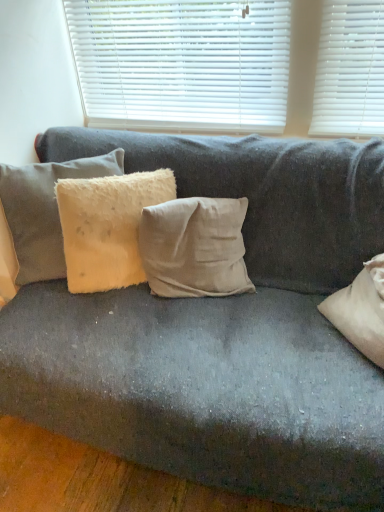
Question: Considering the relative sizes of fuzzy beige pillow at left, the third pillow when ordered from right to left, and fuzzy beige pillow at center, arranged as the 2th pillow when viewed from the left, in the image provided, is fuzzy beige pillow at left, the third pillow when ordered from right to left, shorter than fuzzy beige pillow at center, arranged as the 2th pillow when viewed from the left,?

Choices:
 (A) no
 (B) yes

Answer: (A)

Question: Considering the relative positions of fuzzy beige pillow at left, the third pillow when ordered from right to left, and fuzzy beige pillow at center, arranged as the 2th pillow when viewed from the left, in the image provided, is fuzzy beige pillow at left, the third pillow when ordered from right to left, to the left of fuzzy beige pillow at center, arranged as the 2th pillow when viewed from the left, from the viewer's perspective?

Choices:
 (A) no
 (B) yes

Answer: (B)

Question: Considering the relative sizes of fuzzy beige pillow at left, which appears as the 1th pillow when viewed from the left, and fuzzy beige pillow at center, the 2th pillow from the right, in the image provided, is fuzzy beige pillow at left, which appears as the 1th pillow when viewed from the left, smaller than fuzzy beige pillow at center, the 2th pillow from the right,?

Choices:
 (A) yes
 (B) no

Answer: (B)

Question: Does fuzzy beige pillow at left, the third pillow when ordered from right to left, come in front of fuzzy beige pillow at center, the 2th pillow from the right?

Choices:
 (A) no
 (B) yes

Answer: (A)

Question: Is fuzzy beige pillow at left, which appears as the 1th pillow when viewed from the left, positioned beyond the bounds of fuzzy beige pillow at center, the 2th pillow from the right?

Choices:
 (A) yes
 (B) no

Answer: (A)

Question: Considering their positions, is fuzzy beige pillow at center, arranged as the 2th pillow when viewed from the left, located in front of or behind white plastic blinds at upper center?

Choices:
 (A) front
 (B) behind

Answer: (A)

Question: Looking at their shapes, would you say fuzzy beige pillow at center, arranged as the 2th pillow when viewed from the left, is wider or thinner than white plastic blinds at upper center?

Choices:
 (A) wide
 (B) thin

Answer: (A)

Question: Is point (107, 177) closer or farther from the camera than point (155, 117)?

Choices:
 (A) farther
 (B) closer

Answer: (B)

Question: Is fuzzy beige pillow at center, the 2th pillow from the right, to the left or to the right of white plastic blinds at upper center in the image?

Choices:
 (A) left
 (B) right

Answer: (A)

Question: From the image's perspective, is beige cotton cushion at center, which is counted as the first pillow, starting from the right, positioned above or below white plastic blinds at upper center?

Choices:
 (A) above
 (B) below

Answer: (B)

Question: Is beige cotton cushion at center, which is counted as the first pillow, starting from the right, spatially inside white plastic blinds at upper center, or outside of it?

Choices:
 (A) inside
 (B) outside

Answer: (B)

Question: Looking at the image, does beige cotton cushion at center, which is counted as the first pillow, starting from the right, seem bigger or smaller compared to white plastic blinds at upper center?

Choices:
 (A) big
 (B) small

Answer: (A)

Question: From a real-world perspective, is beige cotton cushion at center, placed as the 3th pillow when sorted from left to right, physically located above or below white plastic blinds at upper center?

Choices:
 (A) below
 (B) above

Answer: (A)

Question: In the image, is fuzzy beige pillow at left, the third pillow when ordered from right to left, positioned in front of or behind fuzzy beige pillow at center, arranged as the 2th pillow when viewed from the left?

Choices:
 (A) front
 (B) behind

Answer: (B)

Question: In terms of height, does fuzzy beige pillow at left, the third pillow when ordered from right to left, look taller or shorter compared to fuzzy beige pillow at center, arranged as the 2th pillow when viewed from the left?

Choices:
 (A) tall
 (B) short

Answer: (A)